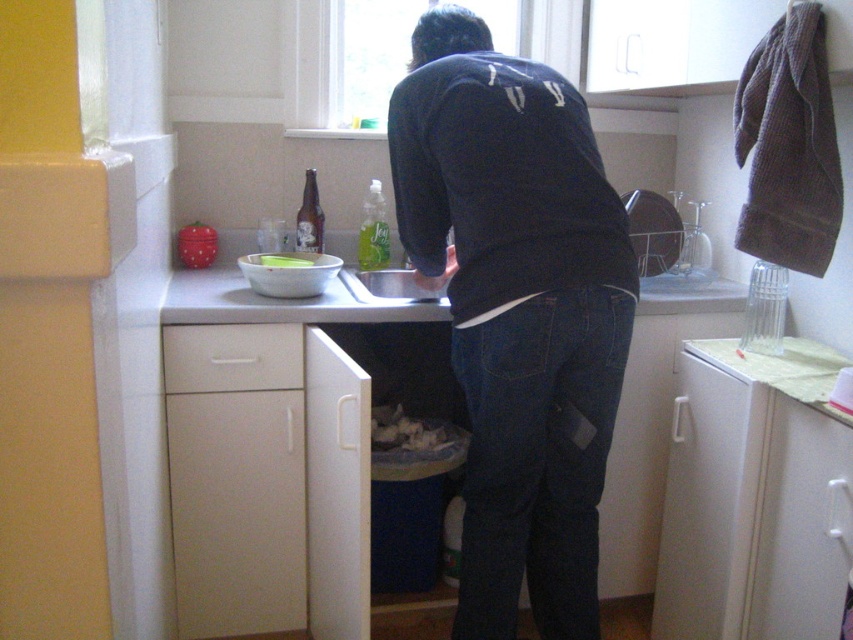
Question: Is dark blue sweater at center positioned in front of brown glass bottle at center?

Choices:
 (A) no
 (B) yes

Answer: (B)

Question: Where is green translucent plastic bottle at center located in relation to green plastic bowl at center in the image?

Choices:
 (A) above
 (B) below

Answer: (A)

Question: Which object is positioned closest to the white plastic dishwasher at lower right?

Choices:
 (A) dark blue sweater at center
 (B) green translucent plastic bottle at center
 (C) green plastic bowl at center

Answer: (A)

Question: Does dark blue sweater at center appear on the left side of brown glass bottle at center?

Choices:
 (A) no
 (B) yes

Answer: (A)

Question: Which is farther from the green translucent plastic bottle at center?

Choices:
 (A) green plastic bowl at center
 (B) dark blue sweater at center

Answer: (B)

Question: Which point appears farthest from the camera in this image?

Choices:
 (A) (386, 243)
 (B) (485, 253)
 (C) (312, 209)

Answer: (A)